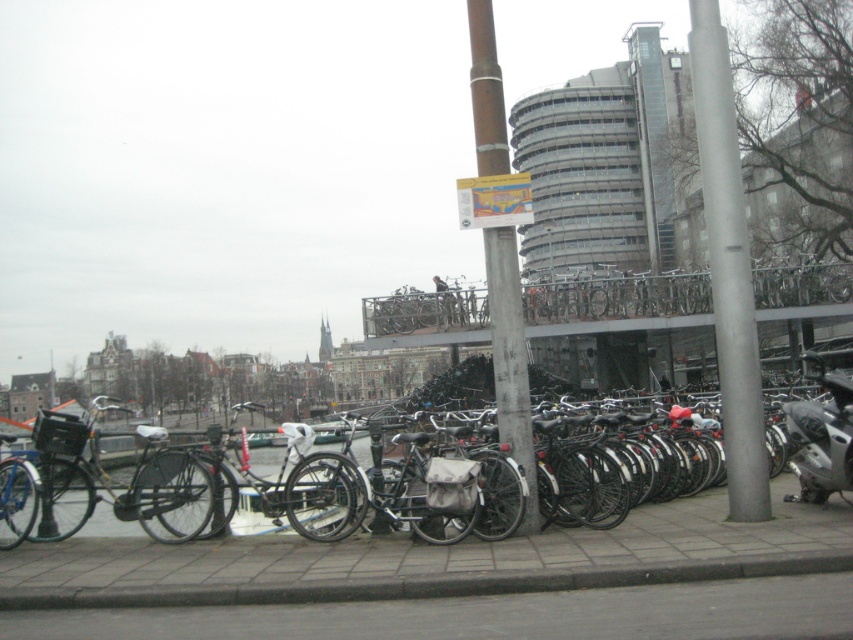
Question: Which object is closer to the camera taking this photo?

Choices:
 (A) concrete pavement at center
 (B) brown wooden pole at center
 (C) matte black bicycle at center

Answer: (A)

Question: Can you confirm if silver metallic pole at center is wider than matte black bicycle at left?

Choices:
 (A) no
 (B) yes

Answer: (A)

Question: Is silver metallic pole at center below matte black bicycle at center?

Choices:
 (A) no
 (B) yes

Answer: (A)

Question: Among these points, which one is farthest from the camera?

Choices:
 (A) 126,552
 (B) 695,564

Answer: (A)

Question: Which object is closer to the camera taking this photo?

Choices:
 (A) silver metallic motorcycle at right
 (B) silver metallic pole at center
 (C) brown wooden pole at center

Answer: (C)

Question: Does silver metallic pole at center have a smaller size compared to silver metallic motorcycle at right?

Choices:
 (A) yes
 (B) no

Answer: (A)